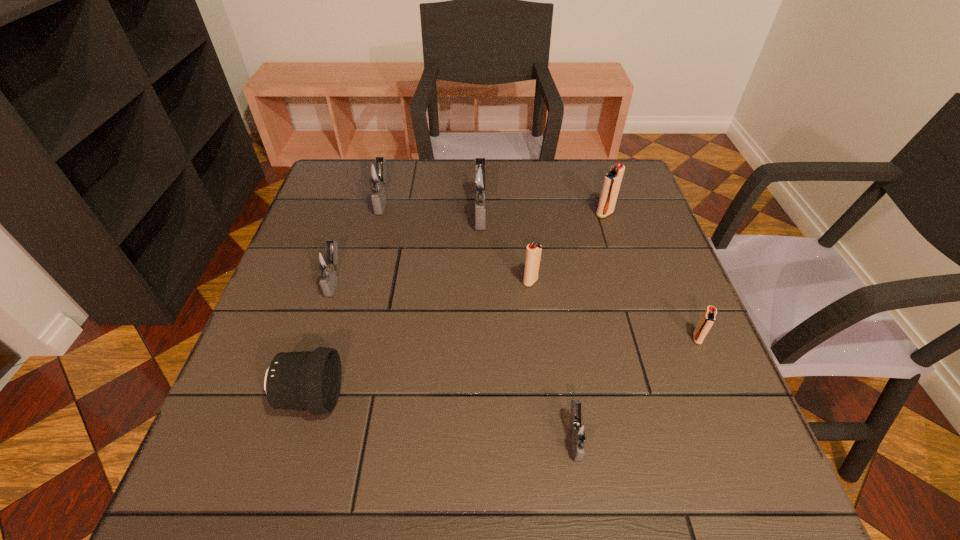
Where is `vacant space located on the right of the rightmost gray igniter`? This screenshot has height=540, width=960. vacant space located on the right of the rightmost gray igniter is located at coordinates (720, 437).

Find the location of a particular element. Image resolution: width=960 pixels, height=540 pixels. object that is at the near edge is located at coordinates (579, 432).

Where is `telephoto lens positioned at the left edge`? This screenshot has height=540, width=960. telephoto lens positioned at the left edge is located at coordinates (309, 380).

Where is `object at the far left corner`? This screenshot has width=960, height=540. object at the far left corner is located at coordinates (375, 173).

In the image, there is a desktop. Where is `free space at the far edge`? This screenshot has height=540, width=960. free space at the far edge is located at coordinates (460, 175).

You are a GUI agent. You are given a task and a screenshot of the screen. Output one action in this format:
    pyautogui.click(x=<x>, y=<y>)
    Task: Click on the free space at the near edge of the desktop
    The width and height of the screenshot is (960, 540).
    Given the screenshot: What is the action you would take?
    pyautogui.click(x=386, y=471)

The width and height of the screenshot is (960, 540). I want to click on free region at the left edge, so click(316, 242).

Identify the location of vacant region at the right edge of the desktop. (672, 307).

Where is `vacant space at the far left corner`? This screenshot has width=960, height=540. vacant space at the far left corner is located at coordinates coord(322,199).

At what (x,y) coordinates should I click in order to perform the action: click on free region at the near left corner. Please return your answer as a coordinate pair (x, y). Image resolution: width=960 pixels, height=540 pixels. Looking at the image, I should click on (219, 489).